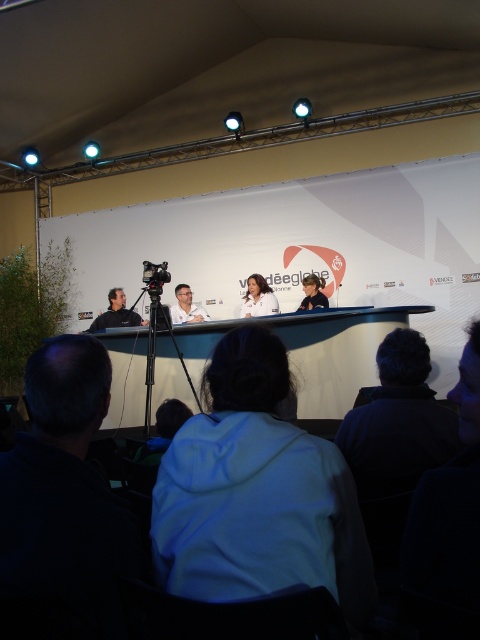
Question: Which object is positioned farthest from the matte black jacket at left?

Choices:
 (A) dark blue fabric at left
 (B) matte black shirt at center

Answer: (A)

Question: Does white glossy table at center have a greater width compared to white fabric at center?

Choices:
 (A) no
 (B) yes

Answer: (B)

Question: Is matte black jacket at left thinner than matte black shirt at center?

Choices:
 (A) no
 (B) yes

Answer: (A)

Question: Which point appears farthest from the camera in this image?

Choices:
 (A) (287, 531)
 (B) (307, 285)
 (C) (273, 308)
 (D) (328, 353)

Answer: (B)

Question: Does white glossy table at center appear under white fabric at center?

Choices:
 (A) yes
 (B) no

Answer: (A)

Question: Estimate the real-world distances between objects in this image. Which object is closer to the dark blue fabric at left?

Choices:
 (A) matte black jacket at left
 (B) white hoodie at center
 (C) white glossy table at center
 (D) matte black shirt at center

Answer: (B)